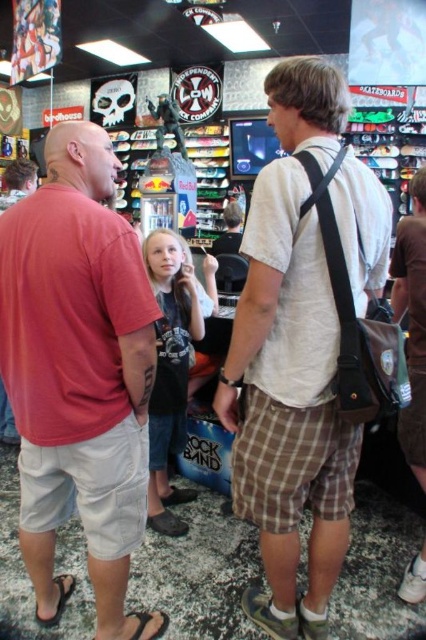
Question: Does light brown plaid shorts at center have a smaller size compared to brown plaid shorts at lower right?

Choices:
 (A) yes
 (B) no

Answer: (B)

Question: Which object is closer to the camera taking this photo?

Choices:
 (A) matte red t-shirt at left
 (B) light brown plaid shorts at center
 (C) brown plaid shorts at lower right

Answer: (A)

Question: Which of the following is the farthest from the observer?

Choices:
 (A) (379, 248)
 (B) (103, 596)

Answer: (B)

Question: Is matte red t-shirt at left below brown plaid shorts at lower right?

Choices:
 (A) no
 (B) yes

Answer: (B)

Question: Among these points, which one is farthest from the camera?

Choices:
 (A) (x=423, y=547)
 (B) (x=62, y=477)
 (C) (x=385, y=228)

Answer: (A)

Question: Is the position of matte red t-shirt at left less distant than that of brown plaid shorts at lower right?

Choices:
 (A) yes
 (B) no

Answer: (A)